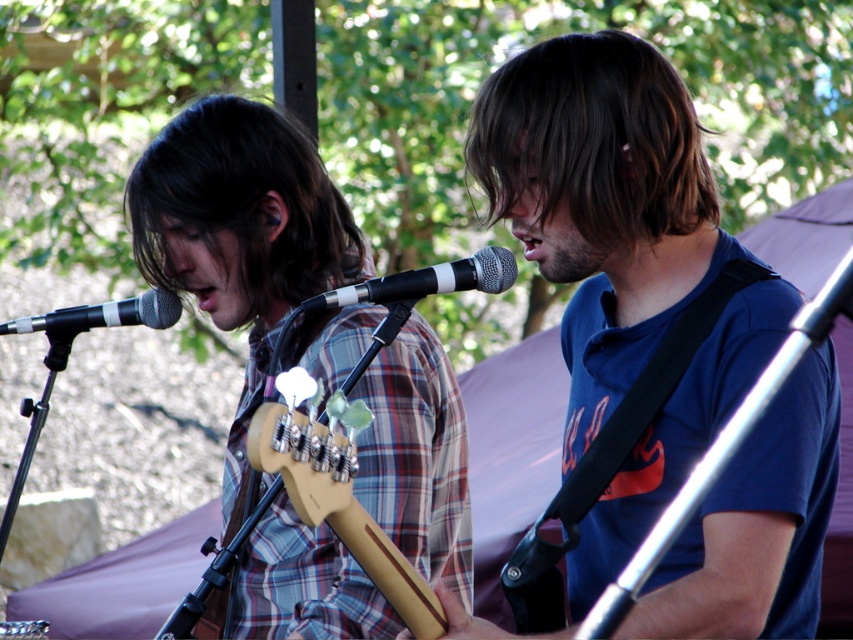
Is blue cotton shirt at center behind black matte microphone at center?

No.

Who is positioned more to the left, blue cotton shirt at center or black matte microphone at center?

black matte microphone at center

Is point (740, 506) positioned after point (500, 262)?

No, it is in front of (500, 262).

The image size is (853, 640). Identify the location of blue cotton shirt at center. (601, 202).

Consider the image. Can you confirm if blue cotton shirt at center is positioned above matte black microphone at left?

No, blue cotton shirt at center is not above matte black microphone at left.

What do you see at coordinates (601, 202) in the screenshot? Image resolution: width=853 pixels, height=640 pixels. I see `blue cotton shirt at center` at bounding box center [601, 202].

Identify the location of blue cotton shirt at center. This screenshot has height=640, width=853. (601, 202).

Which of these two, light wood/glossy guitar at center or black matte microphone at center, stands taller?

Standing taller between the two is light wood/glossy guitar at center.

Who is lower down, light wood/glossy guitar at center or black matte microphone at center?

Positioned lower is light wood/glossy guitar at center.

Is point (309, 515) closer to viewer compared to point (408, 280)?

Yes, point (309, 515) is in front of point (408, 280).

Locate an element on the screen. This screenshot has width=853, height=640. light wood/glossy guitar at center is located at coordinates (335, 490).